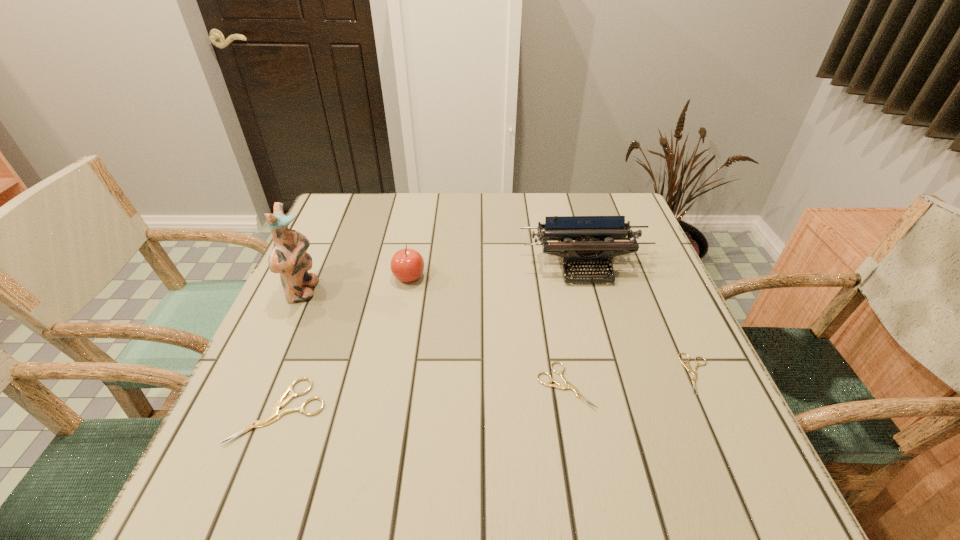
Where is `free space located 0.300m on the back of the fourth tallest object`? The image size is (960, 540). free space located 0.300m on the back of the fourth tallest object is located at coordinates (330, 278).

Find the location of a particular element. Image resolution: width=960 pixels, height=540 pixels. vacant area situated 0.130m on the back of the second shortest object is located at coordinates [553, 316].

The height and width of the screenshot is (540, 960). Find the location of `free spot located 0.170m on the left of the shortest shears`. free spot located 0.170m on the left of the shortest shears is located at coordinates (598, 374).

The image size is (960, 540). Find the location of `blank space located 0.100m on the right of the apple`. blank space located 0.100m on the right of the apple is located at coordinates (466, 277).

Find the location of a particular element. This screenshot has width=960, height=540. vacant position located 0.260m on the typing side of the second tallest object is located at coordinates (613, 374).

The width and height of the screenshot is (960, 540). I want to click on free spot located on the front-facing side of the figurine, so click(x=406, y=292).

The height and width of the screenshot is (540, 960). I want to click on shears present at the left edge, so click(275, 413).

At what (x,y) coordinates should I click in order to perform the action: click on figurine that is at the left edge. Please return your answer as a coordinate pair (x, y). The image size is (960, 540). Looking at the image, I should click on (288, 256).

Identify the location of shears situated at the right edge. (688, 367).

Where is `typewriter that is at the right edge`? This screenshot has height=540, width=960. typewriter that is at the right edge is located at coordinates (594, 246).